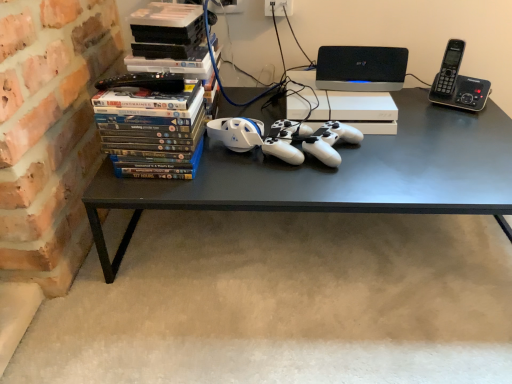
Question: Is matte plastic dvds at left inside black matte desk at center?

Choices:
 (A) no
 (B) yes

Answer: (A)

Question: From the image's perspective, is black matte desk at center located beneath matte plastic dvds at left?

Choices:
 (A) no
 (B) yes

Answer: (B)

Question: From the image's perspective, is black matte desk at center on matte plastic dvds at left?

Choices:
 (A) yes
 (B) no

Answer: (B)

Question: Is black matte desk at center looking in the opposite direction of matte plastic dvds at left?

Choices:
 (A) yes
 (B) no

Answer: (B)

Question: Can you confirm if black matte desk at center is shorter than matte plastic dvds at left?

Choices:
 (A) no
 (B) yes

Answer: (A)

Question: Is matte plastic dvds at left bigger or smaller than black plastic phone at upper right?

Choices:
 (A) big
 (B) small

Answer: (A)

Question: Looking at their shapes, would you say matte plastic dvds at left is wider or thinner than black plastic phone at upper right?

Choices:
 (A) thin
 (B) wide

Answer: (B)

Question: From a real-world perspective, is matte plastic dvds at left above or below black plastic phone at upper right?

Choices:
 (A) below
 (B) above

Answer: (A)

Question: Considering the positions of matte plastic dvds at left and black plastic phone at upper right in the image, is matte plastic dvds at left taller or shorter than black plastic phone at upper right?

Choices:
 (A) tall
 (B) short

Answer: (A)

Question: Considering the positions of black plastic phone at upper right and black matte desk at center in the image, is black plastic phone at upper right wider or thinner than black matte desk at center?

Choices:
 (A) thin
 (B) wide

Answer: (A)

Question: Is black plastic phone at upper right inside or outside of black matte desk at center?

Choices:
 (A) inside
 (B) outside

Answer: (B)

Question: In the image, is black plastic phone at upper right on the left side or the right side of black matte desk at center?

Choices:
 (A) left
 (B) right

Answer: (B)

Question: Considering their positions, is black plastic phone at upper right located in front of or behind black matte desk at center?

Choices:
 (A) front
 (B) behind

Answer: (B)

Question: Considering the relative positions of black plastic phone at upper right and matte plastic dvds at left in the image provided, is black plastic phone at upper right to the left or to the right of matte plastic dvds at left?

Choices:
 (A) left
 (B) right

Answer: (B)

Question: Would you say black plastic phone at upper right is inside or outside matte plastic dvds at left?

Choices:
 (A) outside
 (B) inside

Answer: (A)